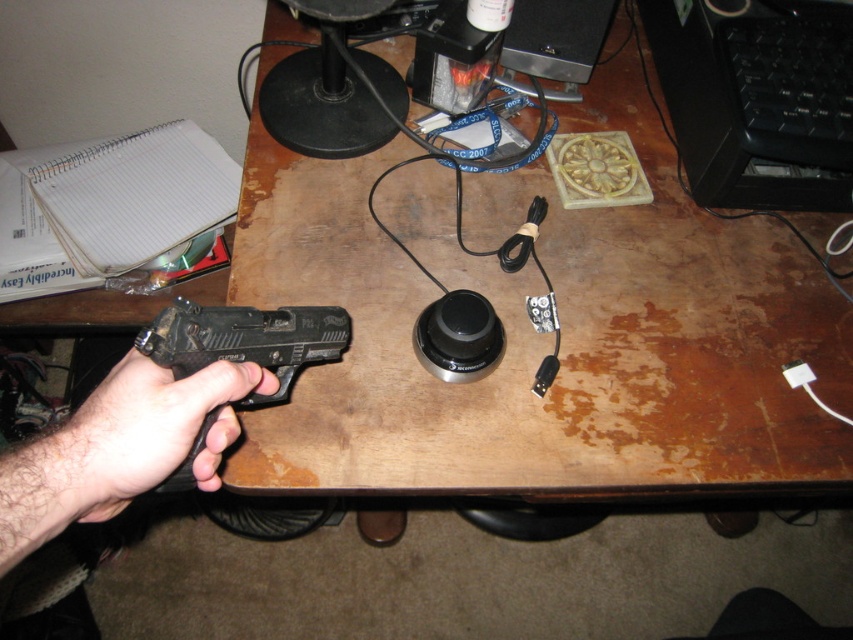
You are a security guard in a museum and you see the brown wooden desk at center and the black matte handgun at left. Which object is closer to you, the observer?

The brown wooden desk at center is closer to you because the black matte handgun at left is behind it, meaning the desk is in front of the handgun.

You are a security guard who needs to secure all firearms on the desk. You see the black matte gun at lower left and the black matte handgun at left. Which one is closer to the edge of the desk?

The black matte gun at lower left is 1.02 inches away from the black matte handgun at left. However, the distance between them does not indicate their proximity to the desk edge. Without additional information about their positions relative to the desk edges, it is impossible to determine which is closer.

You are a security guard who needs to retrieve the black matte gun at lower left from a distance of 16.24 inches. Is there any object between you and the gun that you need to avoid?

The black matte gun at lower left and camera are 16.24 inches apart. There is a camera between you and the gun, so you need to avoid it when retrieving the gun.